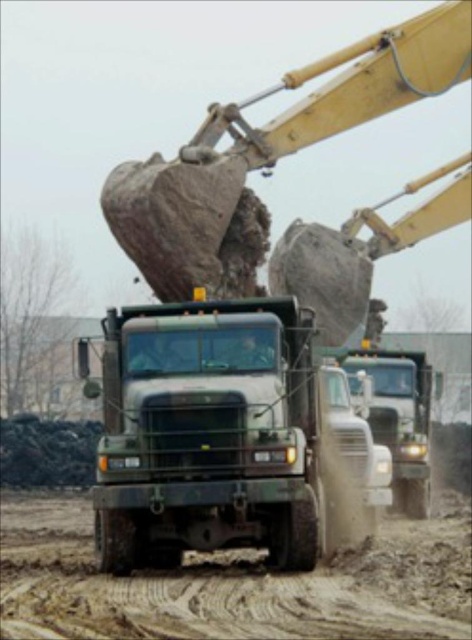
Question: Does green matte truck at center appear under metallic silver truck at center?

Choices:
 (A) yes
 (B) no

Answer: (B)

Question: From the image, what is the correct spatial relationship of green matte truck at center in relation to metallic silver truck at center?

Choices:
 (A) left
 (B) right

Answer: (A)

Question: Which object appears farthest from the camera in this image?

Choices:
 (A) green matte truck at center
 (B) metallic silver truck at center

Answer: (B)

Question: Is green matte truck at center above metallic silver truck at center?

Choices:
 (A) no
 (B) yes

Answer: (B)